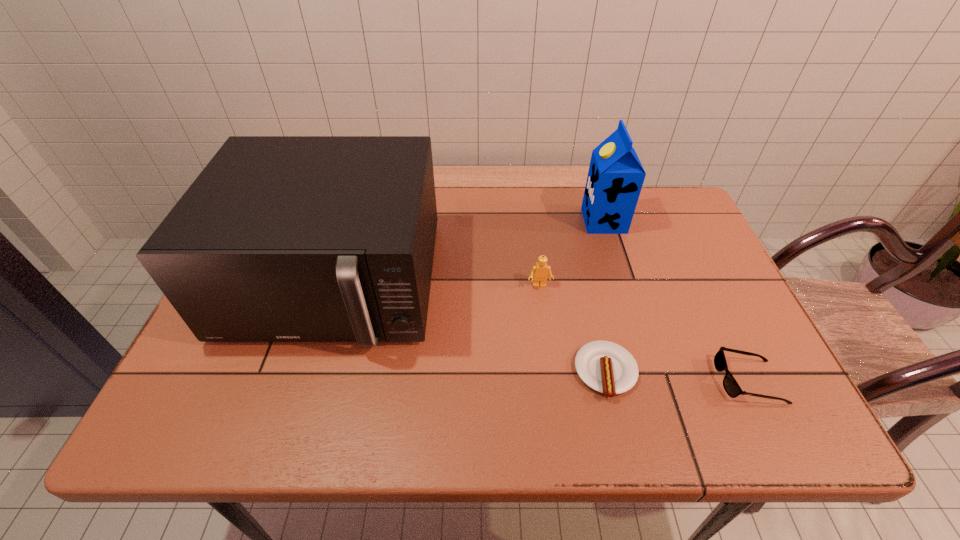
Point out which object is positioned as the fourth nearest to the second object from left to right. Please provide its 2D coordinates. Your answer should be formatted as a tuple, i.e. [(x, y)], where the tuple contains the x and y coordinates of a point satisfying the conditions above.

[(732, 388)]

At what (x,y) coordinates should I click in order to perform the action: click on object that is the second closest one to the fourth tallest object. Please return your answer as a coordinate pair (x, y). Looking at the image, I should click on (539, 273).

The image size is (960, 540). Find the location of `free space that satisfies the following two spatial constraints: 1. on the face of the third tallest object; 2. on the right side of the sausage`. free space that satisfies the following two spatial constraints: 1. on the face of the third tallest object; 2. on the right side of the sausage is located at coordinates (550, 372).

You are a GUI agent. You are given a task and a screenshot of the screen. Output one action in this format:
    pyautogui.click(x=<x>, y=<y>)
    Task: Click on the vacant space that satisfies the following two spatial constraints: 1. with the cap open on the carton; 2. on the front-facing side of the microwave oven
    This screenshot has width=960, height=540.
    Given the screenshot: What is the action you would take?
    pyautogui.click(x=622, y=282)

Locate an element on the screen. The image size is (960, 540). free location that satisfies the following two spatial constraints: 1. on the front-facing side of the microwave oven; 2. on the left side of the shortest object is located at coordinates (306, 372).